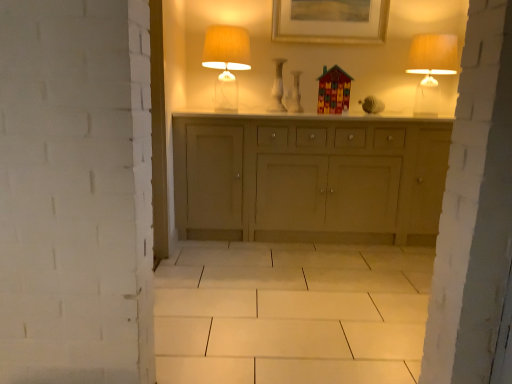
Question: Considering the positions of white glossy vase at center and translucent glass table lamp at upper center, marked as the 1th table lamp in a left-to-right arrangement, in the image, is white glossy vase at center bigger or smaller than translucent glass table lamp at upper center, marked as the 1th table lamp in a left-to-right arrangement,?

Choices:
 (A) small
 (B) big

Answer: (A)

Question: Is white glossy vase at center taller or shorter than translucent glass table lamp at upper center, marked as the 1th table lamp in a left-to-right arrangement?

Choices:
 (A) short
 (B) tall

Answer: (A)

Question: Estimate the real-world distances between objects in this image. Which object is closer to the white glossy vase at center?

Choices:
 (A) matte cream table lamp at upper right, which appears as the second table lamp when viewed from the left
 (B) gold-framed picture at upper center
 (C) translucent glass table lamp at upper center, which is the second table lamp in right-to-left order

Answer: (C)

Question: Estimate the real-world distances between objects in this image. Which object is farther from the matte cream table lamp at upper right, which appears as the second table lamp when viewed from the left?

Choices:
 (A) gold-framed picture at upper center
 (B) white glossy vase at center
 (C) translucent glass table lamp at upper center, marked as the 1th table lamp in a left-to-right arrangement

Answer: (C)